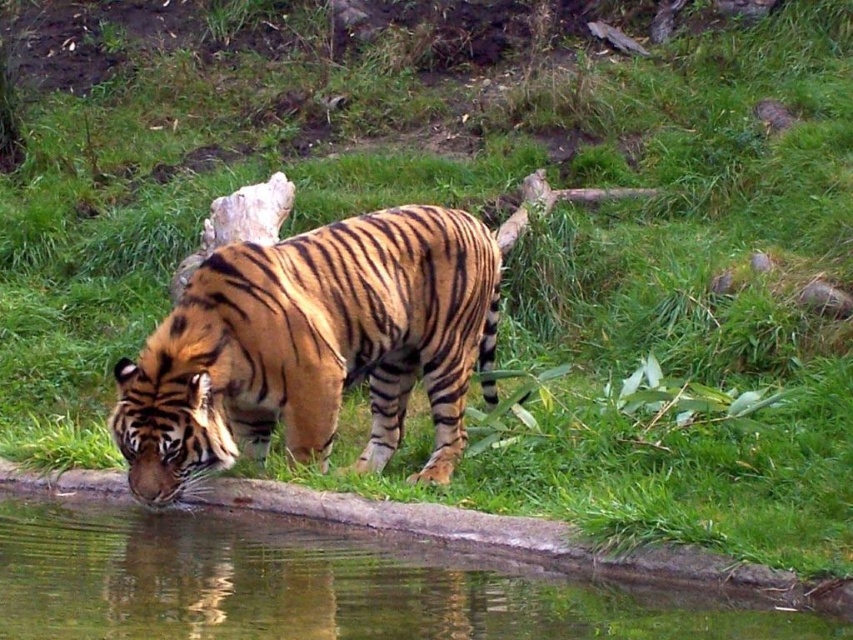
Question: Which of the following is the farthest from the observer?

Choices:
 (A) [x=248, y=547]
 (B) [x=407, y=208]

Answer: (B)

Question: Is orange-brown striped tiger at center positioned in front of clear water at pond center?

Choices:
 (A) yes
 (B) no

Answer: (B)

Question: Among these points, which one is farthest from the camera?

Choices:
 (A) (234, 573)
 (B) (256, 445)

Answer: (B)

Question: Can you confirm if orange-brown striped tiger at center is bigger than clear water at pond center?

Choices:
 (A) no
 (B) yes

Answer: (B)

Question: Can you confirm if orange-brown striped tiger at center is smaller than clear water at pond center?

Choices:
 (A) no
 (B) yes

Answer: (A)

Question: Which object is closer to the camera taking this photo?

Choices:
 (A) clear water at pond center
 (B) orange-brown striped tiger at center

Answer: (A)